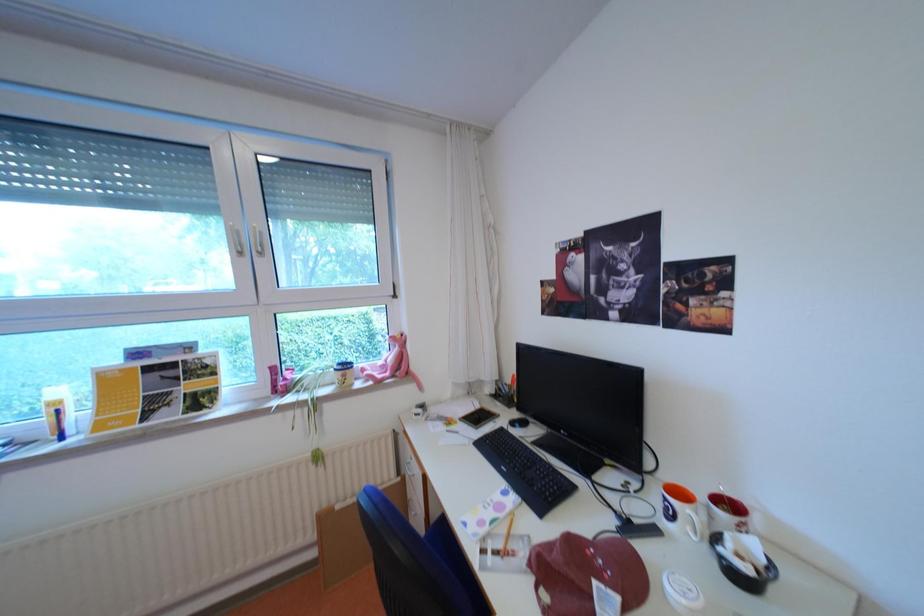
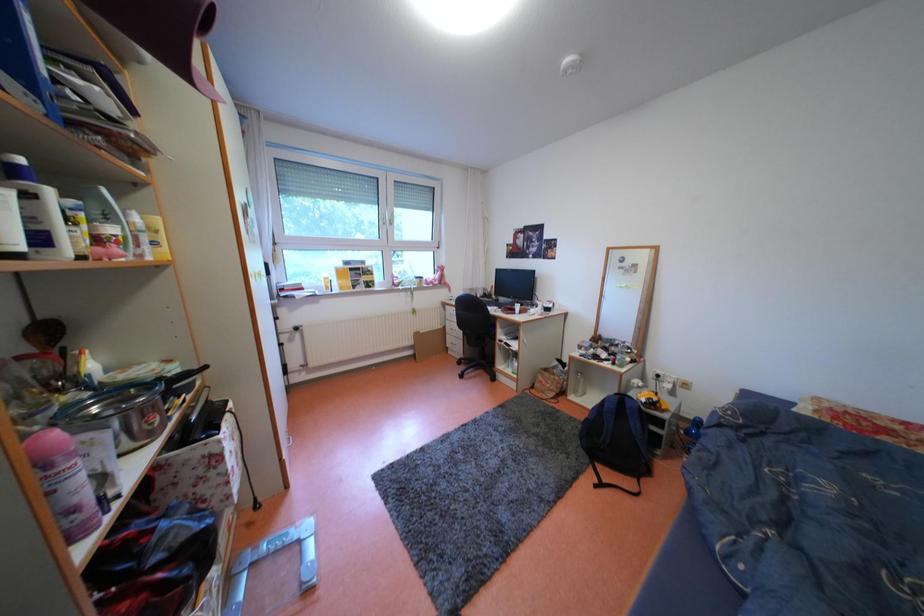
What movement of the cameraman would produce the second image?

The movement direction of the cameraman is left, backward.